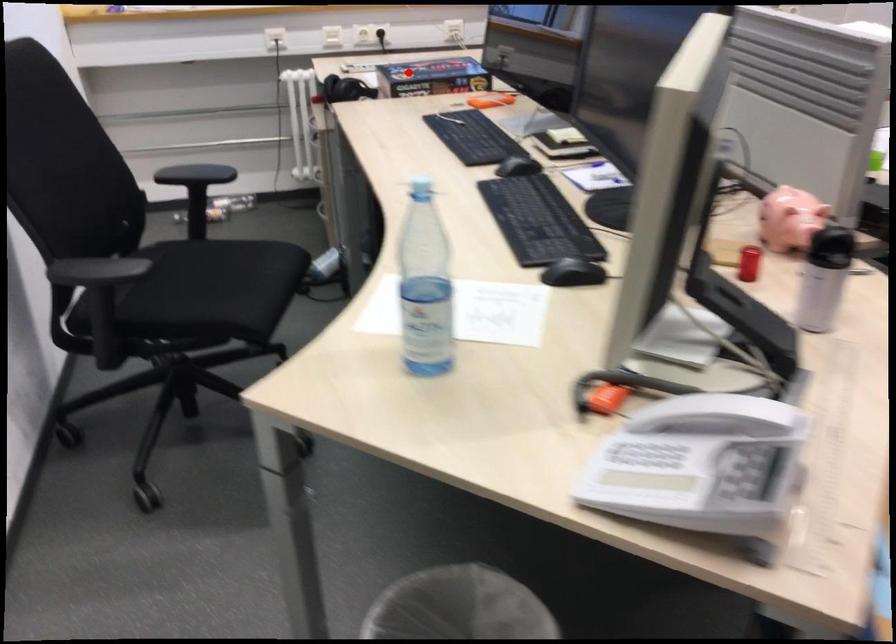
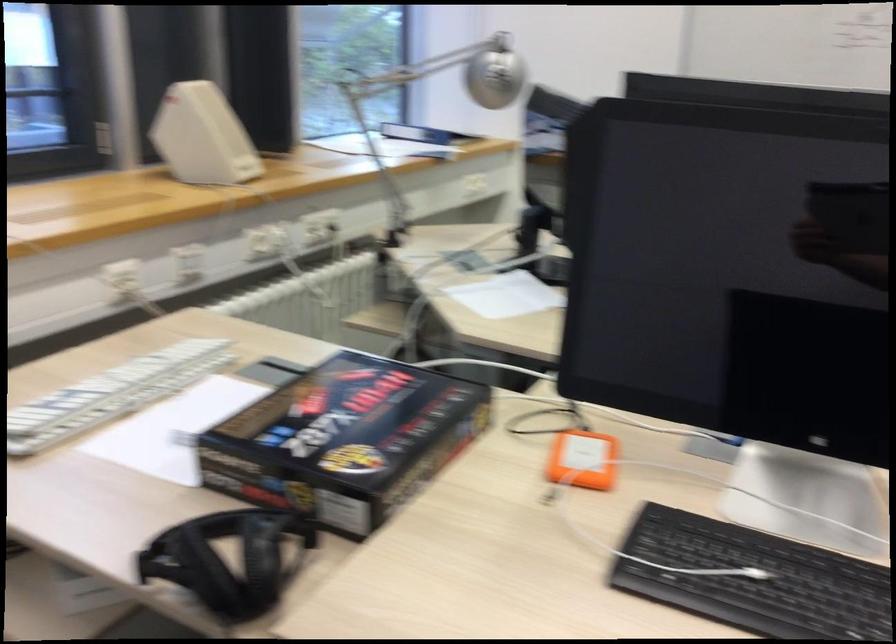
Question: I am providing you with two images of the same scene from different viewpoints. A red point is marked on the first image. At the location where the point appears in image 1, is it still visible in image 2?

Choices:
 (A) Yes
 (B) No

Answer: (A)